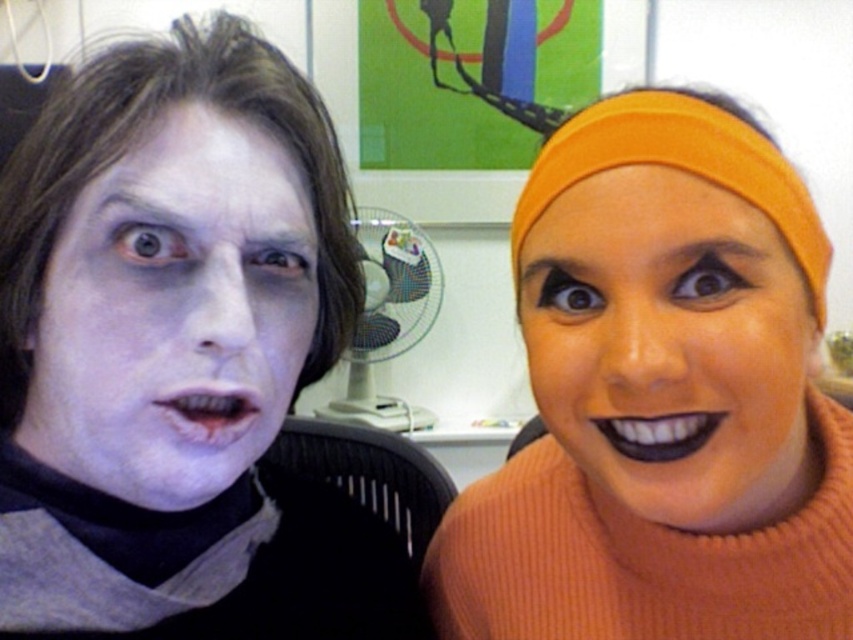
Between pale matte face at left and matte orange headband at upper right, which one appears on the right side from the viewer's perspective?

matte orange headband at upper right

From the picture: Between pale matte face at left and matte orange headband at upper right, which one is positioned higher?

Positioned higher is pale matte face at left.

Is point (213, 486) positioned in front of point (561, 355)?

Yes, point (213, 486) is in front of point (561, 355).

The height and width of the screenshot is (640, 853). I want to click on pale matte face at left, so click(173, 310).

Can you confirm if orange fabric headband at upper right is positioned to the right of pale matte face at left?

Yes, orange fabric headband at upper right is to the right of pale matte face at left.

Is point (779, 362) farther from camera compared to point (36, 342)?

No, (779, 362) is in front of (36, 342).

Who is more distant from viewer, (641, 593) or (53, 316)?

The point (641, 593) is behind.

The width and height of the screenshot is (853, 640). In order to click on orange fabric headband at upper right in this screenshot , I will do `click(660, 397)`.

Does orange fabric headband at upper right have a greater height compared to matte orange headband at upper right?

Yes, orange fabric headband at upper right is taller than matte orange headband at upper right.

Is orange fabric headband at upper right to the left of matte orange headband at upper right from the viewer's perspective?

Yes, orange fabric headband at upper right is to the left of matte orange headband at upper right.

Between point (834, 449) and point (622, 276), which one is positioned behind?

Point (834, 449)

The height and width of the screenshot is (640, 853). I want to click on orange fabric headband at upper right, so click(660, 397).